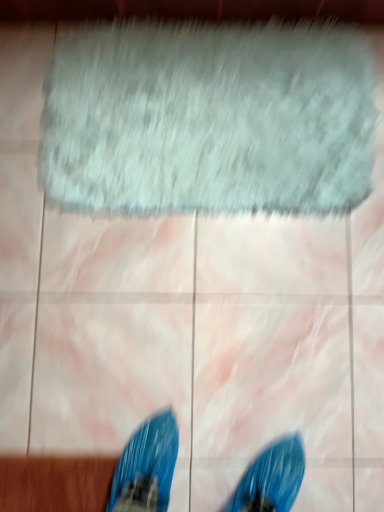
Locate an element on the screen. This screenshot has width=384, height=512. vacant area that is in front of gray fuzzy bath mat at upper center is located at coordinates (196, 339).